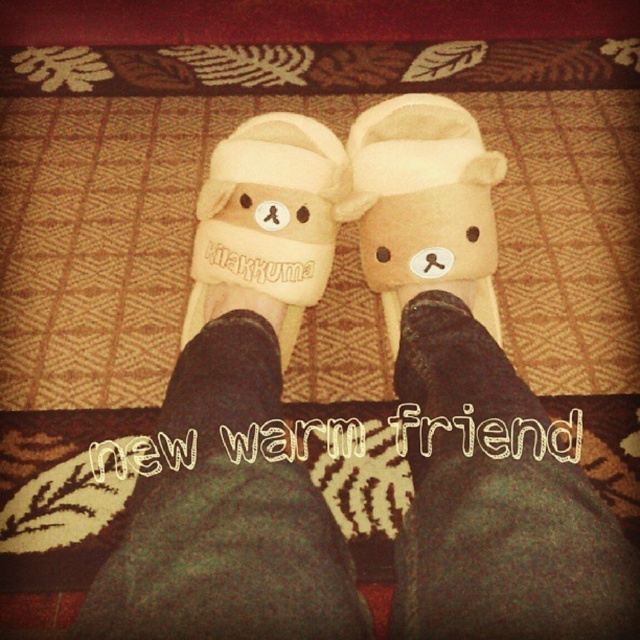
From the picture: Who is lower down, beige soft plush bear slipper at center or beige fabric slipper at center?

beige soft plush bear slipper at center is lower down.

Does beige soft plush bear slipper at center have a lesser height compared to beige fabric slipper at center?

Correct, beige soft plush bear slipper at center is not as tall as beige fabric slipper at center.

Who is more distant from viewer, (433, 161) or (285, 241)?

Positioned behind is point (285, 241).

This screenshot has height=640, width=640. I want to click on beige soft plush bear slipper at center, so tap(422, 205).